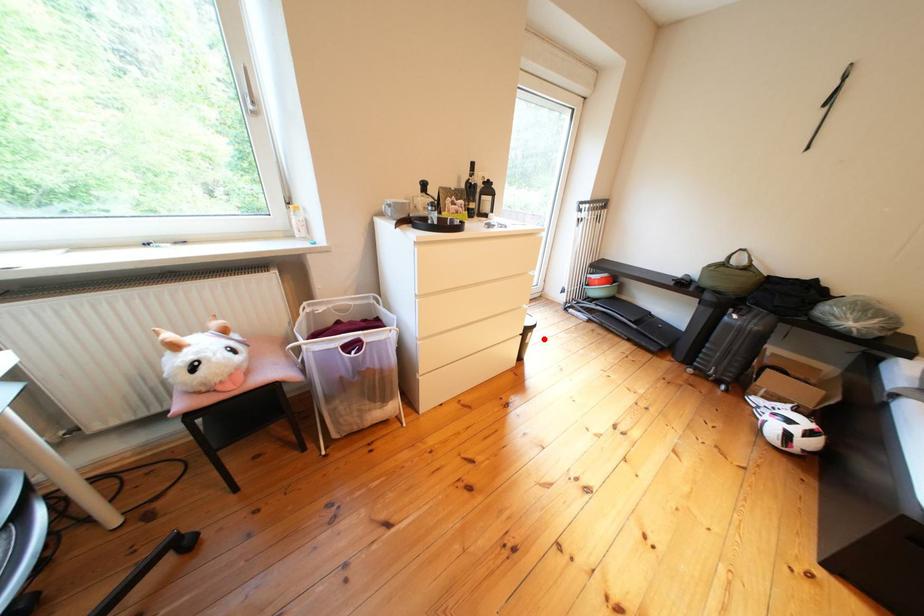
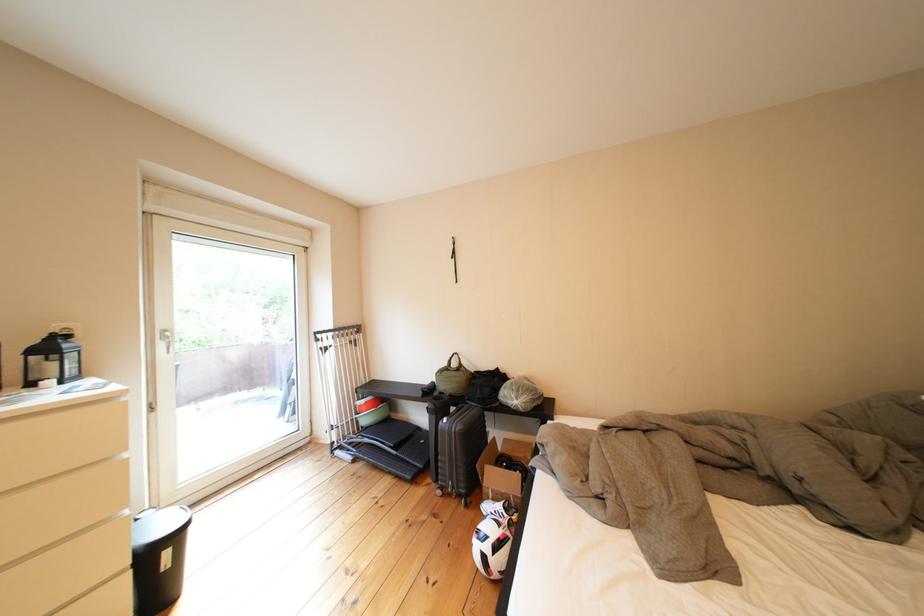
Locate, in the second image, the point that corresponds to the highlighted location in the first image.

(179, 557)